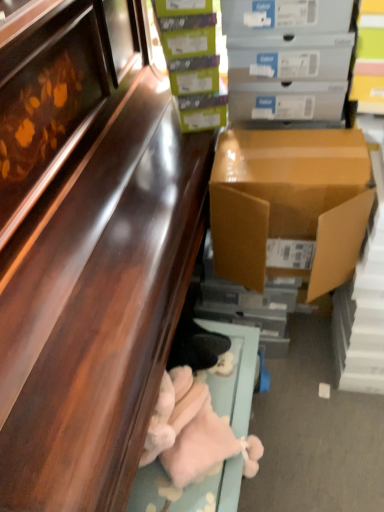
This screenshot has width=384, height=512. I want to click on shiny brown cabinet at lower left, so click(x=100, y=310).

Identify the location of brown cardboard box at right, placed as the third box when sorted from top to bottom. The height and width of the screenshot is (512, 384). (289, 205).

I want to click on shiny brown cabinet at lower left, so click(x=100, y=310).

Considering the relative sizes of green matte box at upper center, arranged as the 2th box when viewed from the top, and brown cardboard box at right, the first box when ordered from bottom to top, in the image provided, is green matte box at upper center, arranged as the 2th box when viewed from the top, bigger than brown cardboard box at right, the first box when ordered from bottom to top,?

Incorrect, green matte box at upper center, arranged as the 2th box when viewed from the top, is not larger than brown cardboard box at right, the first box when ordered from bottom to top.

Based on the photo, from a real-world perspective, is green matte box at upper center, arranged as the 2th box when viewed from the top, beneath brown cardboard box at right, placed as the third box when sorted from top to bottom?

Actually, green matte box at upper center, arranged as the 2th box when viewed from the top, is physically above brown cardboard box at right, placed as the third box when sorted from top to bottom, in the real world.

Is green matte box at upper center, arranged as the 2th box when viewed from the top, situated inside brown cardboard box at right, placed as the third box when sorted from top to bottom, or outside?

green matte box at upper center, arranged as the 2th box when viewed from the top, cannot be found inside brown cardboard box at right, placed as the third box when sorted from top to bottom.

Is green matte box at upper center, arranged as the 2th box when viewed from the top, wider than fluffy pink stuffed animal at lower center?

No.

How different are the orientations of green matte box at upper center, placed as the second box when sorted from bottom to top, and fluffy pink stuffed animal at lower center in degrees?

green matte box at upper center, placed as the second box when sorted from bottom to top, and fluffy pink stuffed animal at lower center are facing 96.7 degrees away from each other.

Are green matte box at upper center, placed as the second box when sorted from bottom to top, and fluffy pink stuffed animal at lower center located far from each other?

No, green matte box at upper center, placed as the second box when sorted from bottom to top, is not far from fluffy pink stuffed animal at lower center.

Considering the sizes of objects green matte box at upper center, placed as the second box when sorted from bottom to top, and fluffy pink stuffed animal at lower center in the image provided, who is smaller, green matte box at upper center, placed as the second box when sorted from bottom to top, or fluffy pink stuffed animal at lower center?

With smaller size is fluffy pink stuffed animal at lower center.

In the scene shown: Considering the relative positions of fluffy pink stuffed animal at lower center and matte gray cardboard box at upper right, which is the 3th box in bottom-to-top order, in the image provided, is fluffy pink stuffed animal at lower center to the left or to the right of matte gray cardboard box at upper right, which is the 3th box in bottom-to-top order,?

In the image, fluffy pink stuffed animal at lower center appears on the left side of matte gray cardboard box at upper right, which is the 3th box in bottom-to-top order.

Considering the sizes of objects fluffy pink stuffed animal at lower center and matte gray cardboard box at upper right, placed as the first box when sorted from top to bottom, in the image provided, who is thinner, fluffy pink stuffed animal at lower center or matte gray cardboard box at upper right, placed as the first box when sorted from top to bottom,?

fluffy pink stuffed animal at lower center is thinner.

Could you tell me if fluffy pink stuffed animal at lower center is turned towards matte gray cardboard box at upper right, which is the 3th box in bottom-to-top order?

No, fluffy pink stuffed animal at lower center is not facing towards matte gray cardboard box at upper right, which is the 3th box in bottom-to-top order.

Is fluffy pink stuffed animal at lower center beside matte gray cardboard box at upper right, placed as the first box when sorted from top to bottom?

No, fluffy pink stuffed animal at lower center is not touching matte gray cardboard box at upper right, placed as the first box when sorted from top to bottom.

Identify the location of the 2nd box behind when counting from the fluffy pink stuffed animal at lower center. The height and width of the screenshot is (512, 384). (288, 42).

Would you consider matte gray cardboard box at upper right, placed as the first box when sorted from top to bottom, to be distant from fluffy pink stuffed animal at lower center?

They are positioned close to each other.

Consider the image. From the image's perspective, which is above, matte gray cardboard box at upper right, placed as the first box when sorted from top to bottom, or fluffy pink stuffed animal at lower center?

matte gray cardboard box at upper right, placed as the first box when sorted from top to bottom, from the image's perspective.

Consider the image. Is matte gray cardboard box at upper right, which is the 3th box in bottom-to-top order, spatially inside fluffy pink stuffed animal at lower center, or outside of it?

The correct answer is: outside.

Does shiny brown cabinet at lower left come in front of fluffy pink stuffed animal at lower center?

Yes, shiny brown cabinet at lower left is in front of fluffy pink stuffed animal at lower center.

From a real-world perspective, which is physically below, shiny brown cabinet at lower left or fluffy pink stuffed animal at lower center?

In real-world perspective, fluffy pink stuffed animal at lower center is lower.

Would you say shiny brown cabinet at lower left is inside or outside fluffy pink stuffed animal at lower center?

shiny brown cabinet at lower left is outside fluffy pink stuffed animal at lower center.

Which is correct: fluffy pink stuffed animal at lower center is inside brown cardboard box at right, the first box when ordered from bottom to top, or outside of it?

fluffy pink stuffed animal at lower center is not enclosed by brown cardboard box at right, the first box when ordered from bottom to top.

Are fluffy pink stuffed animal at lower center and brown cardboard box at right, placed as the third box when sorted from top to bottom, far apart?

No, fluffy pink stuffed animal at lower center is not far from brown cardboard box at right, placed as the third box when sorted from top to bottom.

How much distance is there between fluffy pink stuffed animal at lower center and brown cardboard box at right, placed as the third box when sorted from top to bottom?

13.78 inches.

Is fluffy pink stuffed animal at lower center bigger or smaller than brown cardboard box at right, the first box when ordered from bottom to top?

In the image, fluffy pink stuffed animal at lower center appears to be smaller than brown cardboard box at right, the first box when ordered from bottom to top.

In terms of width, does matte gray cardboard box at upper right, which is the 3th box in bottom-to-top order, look wider or thinner when compared to shiny brown cabinet at lower left?

Clearly, matte gray cardboard box at upper right, which is the 3th box in bottom-to-top order, has less width compared to shiny brown cabinet at lower left.

Does matte gray cardboard box at upper right, placed as the first box when sorted from top to bottom, appear on the right side of shiny brown cabinet at lower left?

Yes.

Find the location of a particular element. Image resolution: width=384 pixels, height=512 pixels. cabinetry in front of the matte gray cardboard box at upper right, placed as the first box when sorted from top to bottom is located at coordinates (100, 310).

The height and width of the screenshot is (512, 384). I want to click on box lying below the green matte box at upper center, arranged as the 2th box when viewed from the top (from the image's perspective), so click(x=289, y=205).

Find the location of a particular element. The height and width of the screenshot is (512, 384). the 3rd box directly above the fluffy pink stuffed animal at lower center (from a real-world perspective) is located at coordinates (193, 62).

Based on their spatial positions, is shiny brown cabinet at lower left or matte gray cardboard box at upper right, placed as the first box when sorted from top to bottom, further from fluffy pink stuffed animal at lower center?

matte gray cardboard box at upper right, placed as the first box when sorted from top to bottom, is further to fluffy pink stuffed animal at lower center.

Looking at this image, based on their spatial positions, is brown cardboard box at right, placed as the third box when sorted from top to bottom, or fluffy pink stuffed animal at lower center closer to shiny brown cabinet at lower left?

brown cardboard box at right, placed as the third box when sorted from top to bottom, is positioned closer to the anchor shiny brown cabinet at lower left.

Considering their positions, is shiny brown cabinet at lower left positioned further to green matte box at upper center, placed as the second box when sorted from bottom to top, than matte gray cardboard box at upper right, placed as the first box when sorted from top to bottom?

shiny brown cabinet at lower left is positioned further to the anchor green matte box at upper center, placed as the second box when sorted from bottom to top.

Estimate the real-world distances between objects in this image. Which object is closer to shiny brown cabinet at lower left, brown cardboard box at right, the first box when ordered from bottom to top, or matte gray cardboard box at upper right, placed as the first box when sorted from top to bottom?

brown cardboard box at right, the first box when ordered from bottom to top, is closer to shiny brown cabinet at lower left.

Which object lies further to the anchor point fluffy pink stuffed animal at lower center, green matte box at upper center, arranged as the 2th box when viewed from the top, or matte gray cardboard box at upper right, placed as the first box when sorted from top to bottom?

matte gray cardboard box at upper right, placed as the first box when sorted from top to bottom, is further to fluffy pink stuffed animal at lower center.

When comparing their distances from shiny brown cabinet at lower left, does matte gray cardboard box at upper right, which is the 3th box in bottom-to-top order, or brown cardboard box at right, placed as the third box when sorted from top to bottom, seem closer?

brown cardboard box at right, placed as the third box when sorted from top to bottom, is closer to shiny brown cabinet at lower left.

Estimate the real-world distances between objects in this image. Which object is closer to brown cardboard box at right, the first box when ordered from bottom to top, shiny brown cabinet at lower left or green matte box at upper center, placed as the second box when sorted from bottom to top?

shiny brown cabinet at lower left is closer to brown cardboard box at right, the first box when ordered from bottom to top.

From the image, which object appears to be farther from matte gray cardboard box at upper right, which is the 3th box in bottom-to-top order, green matte box at upper center, arranged as the 2th box when viewed from the top, or shiny brown cabinet at lower left?

Among the two, shiny brown cabinet at lower left is located further to matte gray cardboard box at upper right, which is the 3th box in bottom-to-top order.

The width and height of the screenshot is (384, 512). I want to click on cabinetry between matte gray cardboard box at upper right, which is the 3th box in bottom-to-top order, and fluffy pink stuffed animal at lower center vertically, so click(100, 310).

Image resolution: width=384 pixels, height=512 pixels. What are the coordinates of `box between matte gray cardboard box at upper right, which is the 3th box in bottom-to-top order, and brown cardboard box at right, placed as the third box when sorted from top to bottom, from top to bottom` in the screenshot? It's located at (193, 62).

This screenshot has height=512, width=384. What are the coordinates of `box between shiny brown cabinet at lower left and matte gray cardboard box at upper right, which is the 3th box in bottom-to-top order, along the z-axis` in the screenshot? It's located at coord(289,205).

Find the location of a particular element. window sill between shiny brown cabinet at lower left and brown cardboard box at right, the first box when ordered from bottom to top, in the front-back direction is located at coordinates (235, 375).